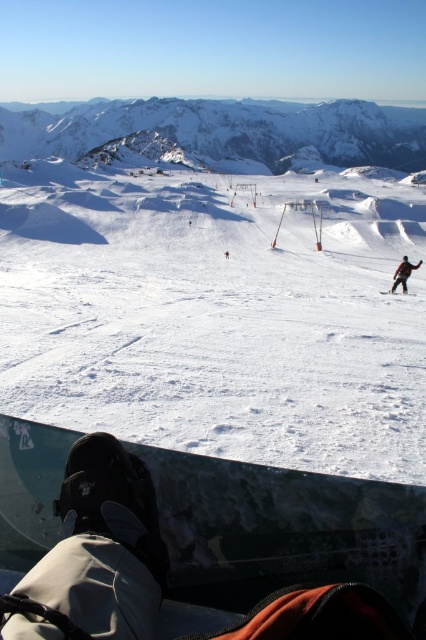
Is white snow-covered mountain at upper center wider than red ski suit at right?

Correct, the width of white snow-covered mountain at upper center exceeds that of red ski suit at right.

Can you confirm if white snow-covered mountain at upper center is smaller than red ski suit at right?

No.

Image resolution: width=426 pixels, height=640 pixels. I want to click on white snow-covered mountain at upper center, so click(x=221, y=131).

Locate an element on the screen. white snow-covered mountain at upper center is located at coordinates click(221, 131).

Does shiny black snowboard at lower center have a greater width compared to red ski suit at right?

No, shiny black snowboard at lower center is not wider than red ski suit at right.

Describe the element at coordinates (284, 531) in the screenshot. The width and height of the screenshot is (426, 640). I see `shiny black snowboard at lower center` at that location.

The image size is (426, 640). What are the coordinates of `shiny black snowboard at lower center` in the screenshot? It's located at (284, 531).

Who is taller, shiny black snowboard at lower center or white snow-covered mountain at upper center?

white snow-covered mountain at upper center

Is shiny black snowboard at lower center to the left of white snow-covered mountain at upper center from the viewer's perspective?

Indeed, shiny black snowboard at lower center is positioned on the left side of white snow-covered mountain at upper center.

This screenshot has height=640, width=426. I want to click on shiny black snowboard at lower center, so click(x=284, y=531).

Identify the location of shiny black snowboard at lower center. Image resolution: width=426 pixels, height=640 pixels. (284, 531).